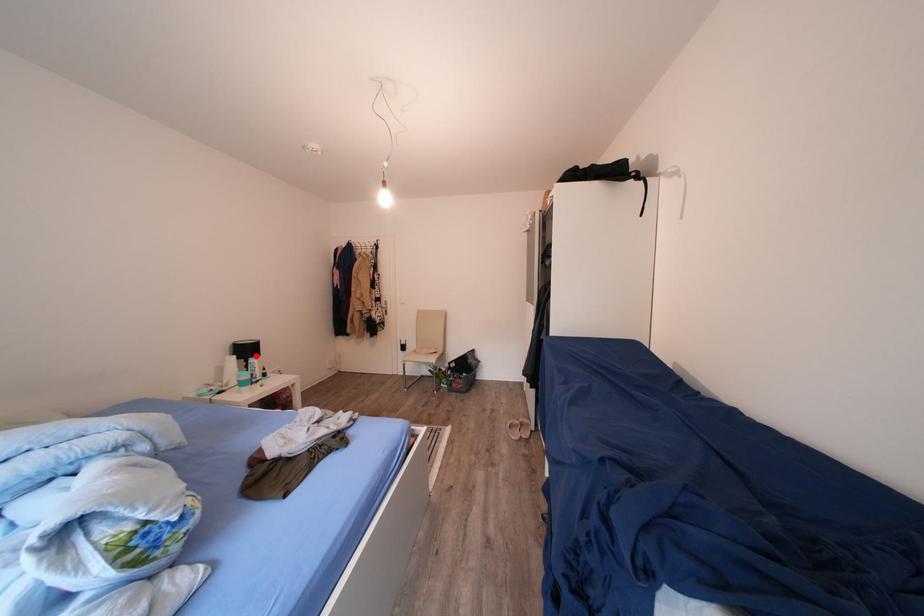
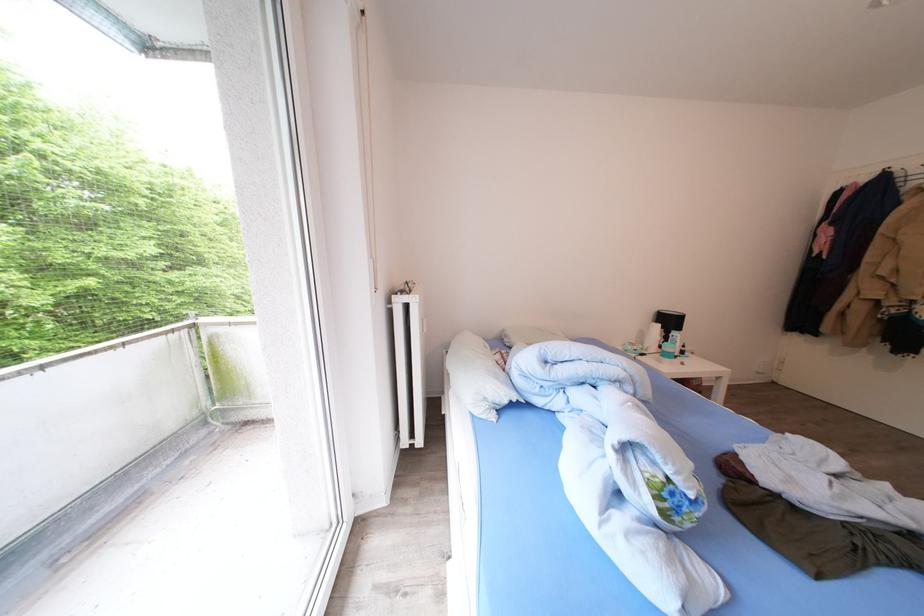
Question: I am providing you with two images of the same scene from different viewpoints. Given a red point in image1, look at the same physical point in image2. Is it:

Choices:
 (A) Closer to the viewpoint
 (B) Farther from the viewpoint

Answer: (B)